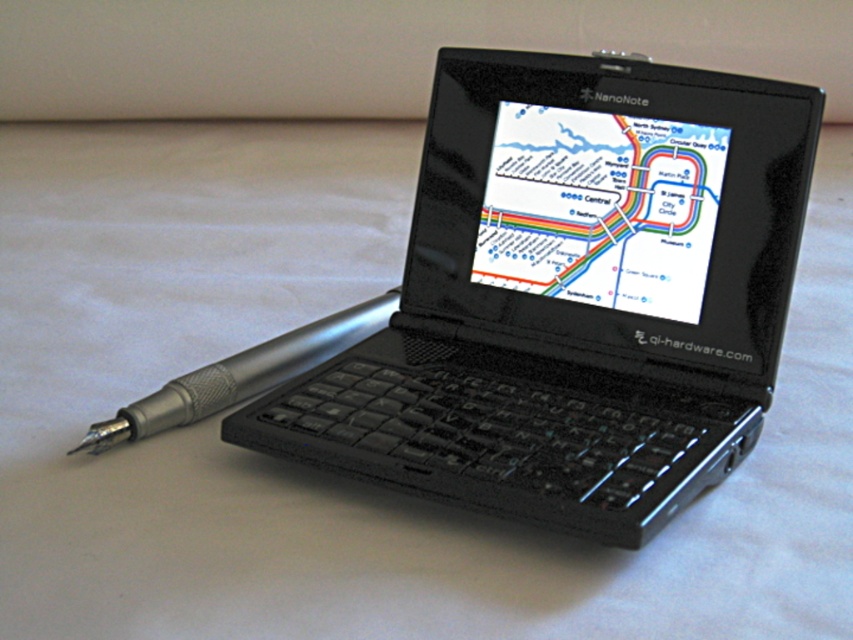
Based on the photo, you are trying to use the stylus to interact with the map displayed on the laptop. Based on their positions, can you reach the matte plastic map at center with the stylus while holding the black matte laptop at center?

The black matte laptop at center is closer to the viewer than the matte plastic map at center, so yes, you can reach the matte plastic map at center with the stylus while holding the black matte laptop at center because the map is behind the laptop and within reach.

You need to place both the black matte laptop at center and the silver metallic pen at left into a rectangular box. The box is exactly as wide as the laptop. Will the pen fit horizontally inside the box?

The black matte laptop at center is wider than the silver metallic pen at left. Since the box is exactly as wide as the laptop, the pen will fit horizontally inside the box because its width is less than the box.

You are trying to determine the best way to store your matte plastic map at center and silver metallic pen at left in a small travel pouch. Given their sizes, which object should you place first into the pouch to ensure both fit properly?

The matte plastic map at center is much taller than the silver metallic pen at left, so you should place the taller matte plastic map at center first into the pouch to accommodate its height before adding the shorter pen.